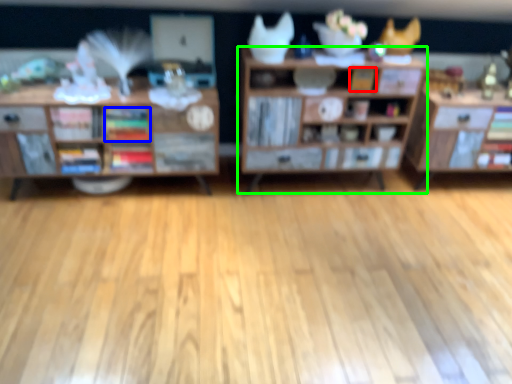
Question: Based on their relative distances, which object is nearer to book (highlighted by a red box)? Choose from book (highlighted by a blue box) and shelf (highlighted by a green box).

Choices:
 (A) book
 (B) shelf

Answer: (B)